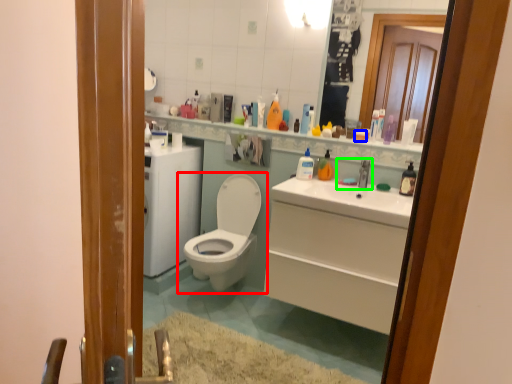
Question: Estimate the real-world distances between objects in this image. Which object is closer to toilet (highlighted by a red box), toiletry (highlighted by a blue box) or sink (highlighted by a green box)?

Choices:
 (A) toiletry
 (B) sink

Answer: (B)